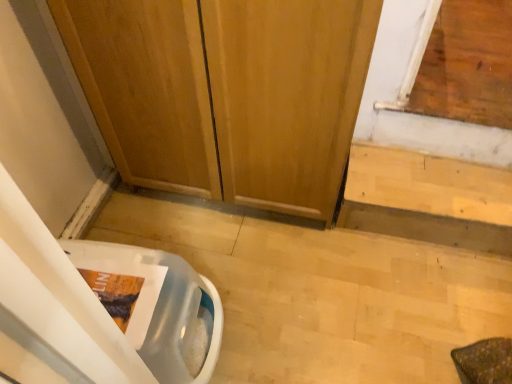
Find the location of `empty space that is ontop of translucent plastic toilet bowl at lower left (from a real-world perspective)`. empty space that is ontop of translucent plastic toilet bowl at lower left (from a real-world perspective) is located at coordinates (127, 281).